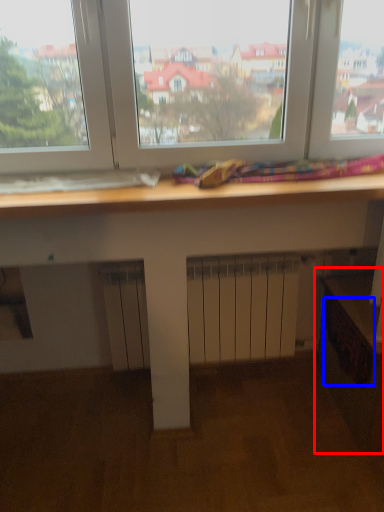
Question: Which of the following is the closest to the observer, workbench (highlighted by a red box) or drawer (highlighted by a blue box)?

Choices:
 (A) workbench
 (B) drawer

Answer: (A)